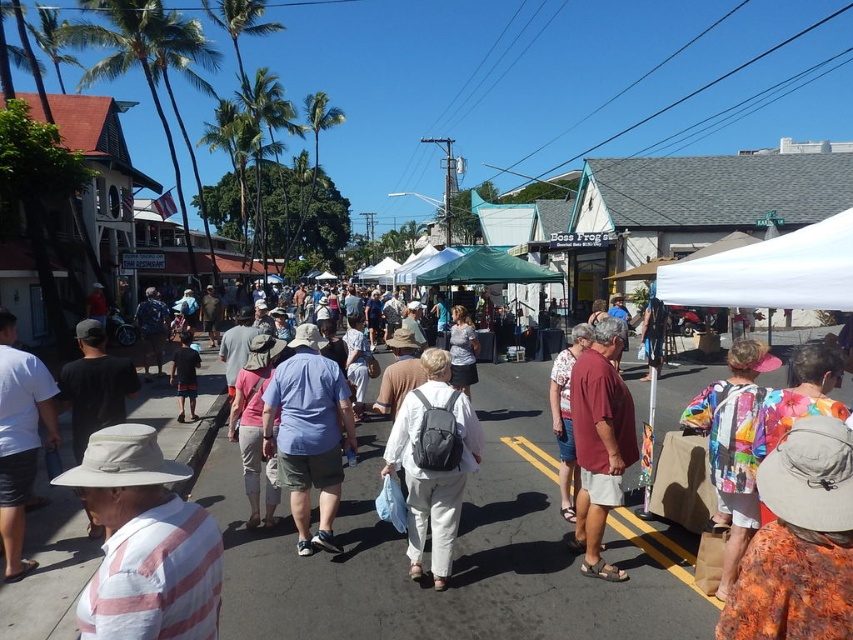
From the picture: You are a photographer trying to capture a photo of both the white striped shirt at left and the maroon fabric shirt at center without any overlap. Based on their widths, is it possible to frame them side by side in the shot?

The white striped shirt at left might be wider than maroon fabric shirt at center, so there is a possibility they can be framed side by side if there is enough space between them. However, the exact arrangement depends on their actual widths and positioning.

You are standing at the point with coordinates point (187, 625) and want to walk towards the point (308, 442). Which direction should you move relative to your current position?

Since point (187, 625) is in front of point (308, 442), you should move backward to reach point (308, 442) from your current position.